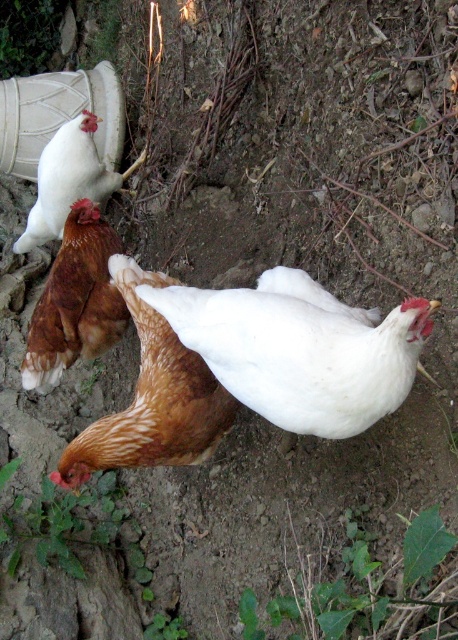
Is brown speckled chicken at center positioned at the back of brown feathered chicken at center?

No, it is in front of brown feathered chicken at center.

Does brown speckled chicken at center appear on the right side of brown feathered chicken at center?

Indeed, brown speckled chicken at center is positioned on the right side of brown feathered chicken at center.

Between point (140, 268) and point (86, 275), which one is positioned behind?

Point (86, 275)

Locate an element on the screen. The width and height of the screenshot is (458, 640). brown speckled chicken at center is located at coordinates [x=152, y=397].

Is point (82, 307) behind point (59, 237)?

No, (82, 307) is in front of (59, 237).

Can you confirm if brown feathered chicken at center is positioned below brown feathered chicken at upper left?

Yes.

Who is more distant from viewer, (53, 314) or (54, 228)?

The point (54, 228) is behind.

You are a GUI agent. You are given a task and a screenshot of the screen. Output one action in this format:
    pyautogui.click(x=<x>, y=<y>)
    Task: Click on the brown feathered chicken at center
    The height and width of the screenshot is (640, 458).
    Given the screenshot: What is the action you would take?
    pyautogui.click(x=75, y=301)

Is white matte chicken at center to the left of brown feathered chicken at upper left from the viewer's perspective?

In fact, white matte chicken at center is to the right of brown feathered chicken at upper left.

Image resolution: width=458 pixels, height=640 pixels. In order to click on white matte chicken at center in this screenshot , I will do `click(299, 349)`.